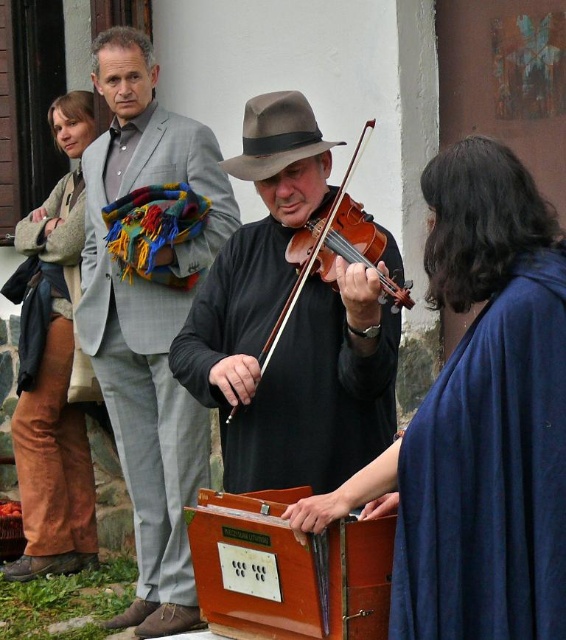
Between blue woolen shawl at center and brown corduroy pants at left, which one is positioned lower?

blue woolen shawl at center is lower down.

Does blue woolen shawl at center appear over brown corduroy pants at left?

No.

Where is `blue woolen shawl at center`? The height and width of the screenshot is (640, 566). blue woolen shawl at center is located at coordinates (478, 419).

Is dark blue fabric dress at lower right shorter than brown corduroy pants at left?

Correct, dark blue fabric dress at lower right is not as tall as brown corduroy pants at left.

Which of these two, dark blue fabric dress at lower right or brown corduroy pants at left, stands shorter?

dark blue fabric dress at lower right

Describe the element at coordinates (490, 474) in the screenshot. This screenshot has width=566, height=640. I see `dark blue fabric dress at lower right` at that location.

At what (x,y) coordinates should I click in order to perform the action: click on dark blue fabric dress at lower right. Please return your answer as a coordinate pair (x, y). Looking at the image, I should click on (490, 474).

Does light gray suit at left appear over brown corduroy pants at left?

Correct, light gray suit at left is located above brown corduroy pants at left.

Based on the photo, between light gray suit at left and brown corduroy pants at left, which one has more height?

light gray suit at left

Where is `light gray suit at left`? Image resolution: width=566 pixels, height=640 pixels. light gray suit at left is located at coordinates (149, 323).

At what (x,y) coordinates should I click in order to perform the action: click on light gray suit at left. Please return your answer as a coordinate pair (x, y). This screenshot has width=566, height=640. Looking at the image, I should click on (149, 323).